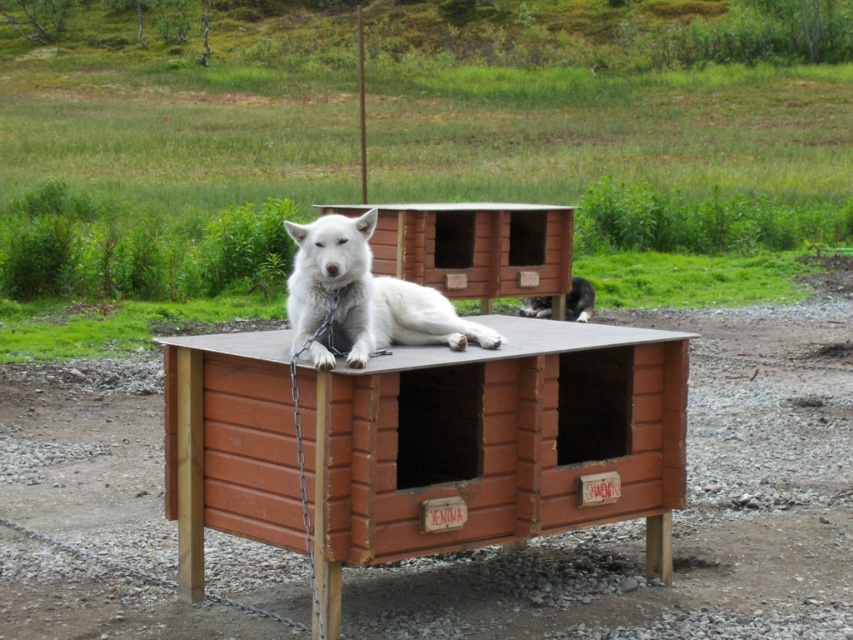
Based on the photo, who is lower down, white fur dog at center or black fur cat at center?

black fur cat at center

Between white fur dog at center and black fur cat at center, which one appears on the left side from the viewer's perspective?

From the viewer's perspective, white fur dog at center appears more on the left side.

Does point (300, 292) lie behind point (566, 314)?

No, (300, 292) is closer to viewer.

You are a GUI agent. You are given a task and a screenshot of the screen. Output one action in this format:
    pyautogui.click(x=<x>, y=<y>)
    Task: Click on the white fur dog at center
    The image size is (853, 640).
    Given the screenshot: What is the action you would take?
    pyautogui.click(x=364, y=296)

Is brown wooden table at center to the left of black fur cat at center from the viewer's perspective?

Yes, brown wooden table at center is to the left of black fur cat at center.

Does brown wooden table at center have a greater height compared to black fur cat at center?

Correct, brown wooden table at center is much taller as black fur cat at center.

Between point (175, 484) and point (583, 294), which one is positioned behind?

Positioned behind is point (583, 294).

In order to click on brown wooden table at center in this screenshot , I will do `click(424, 445)`.

Is brown wooden table at center shorter than white fur dog at center?

Incorrect, brown wooden table at center's height does not fall short of white fur dog at center's.

What do you see at coordinates (424, 445) in the screenshot? I see `brown wooden table at center` at bounding box center [424, 445].

The width and height of the screenshot is (853, 640). I want to click on brown wooden table at center, so click(424, 445).